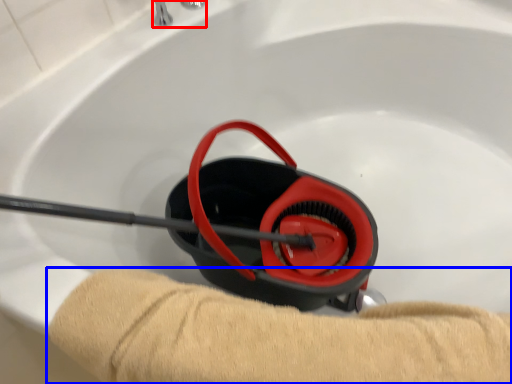
Question: Which of the following is the farthest to the observer, faucet (highlighted by a red box) or tan (highlighted by a blue box)?

Choices:
 (A) faucet
 (B) tan

Answer: (A)